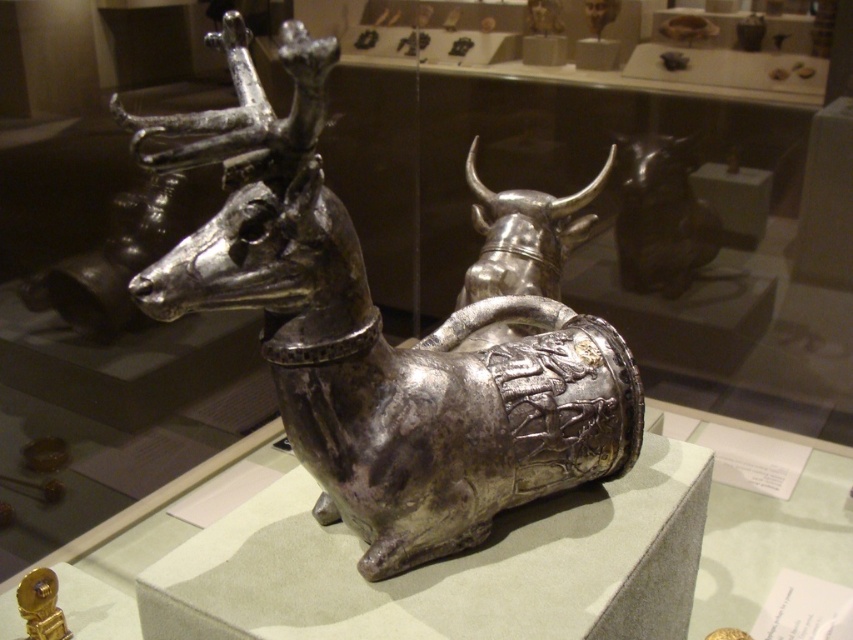
Question: Observing the image, what is the correct spatial positioning of polished silver bull at center in reference to shiny black statue at upper right?

Choices:
 (A) left
 (B) right

Answer: (A)

Question: Which object appears closest to the camera in this image?

Choices:
 (A) shiny black statue at upper right
 (B) polished silver bull at center

Answer: (B)

Question: Among these objects, which one is farthest from the camera?

Choices:
 (A) shiny silver deer at center
 (B) polished silver bull at center
 (C) shiny black statue at upper right

Answer: (C)

Question: Observing the image, what is the correct spatial positioning of shiny silver deer at center in reference to polished silver bull at center?

Choices:
 (A) above
 (B) below

Answer: (B)

Question: Which of the following is the closest to the observer?

Choices:
 (A) (468, 157)
 (B) (643, 291)
 (C) (486, 518)

Answer: (C)

Question: Does polished silver bull at center appear over shiny black statue at upper right?

Choices:
 (A) no
 (B) yes

Answer: (A)